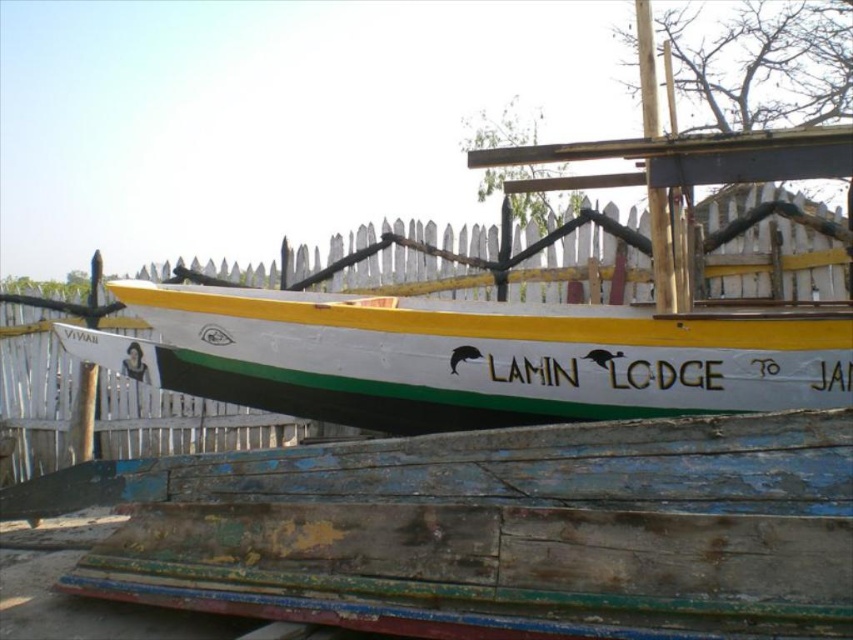
Question: Is white painted wood boat at center to the right of white wooden fence at center from the viewer's perspective?

Choices:
 (A) yes
 (B) no

Answer: (A)

Question: Is white painted wood boat at center bigger than white wooden fence at center?

Choices:
 (A) yes
 (B) no

Answer: (B)

Question: Is white painted wood boat at center wider than white wooden fence at center?

Choices:
 (A) no
 (B) yes

Answer: (B)